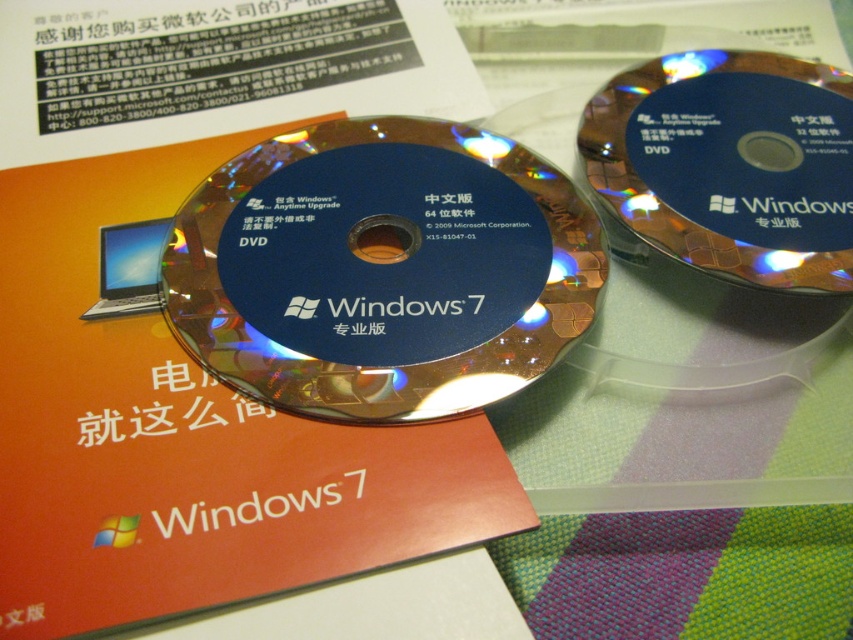
From the picture: Who is positioned more to the left, glossy blue dvd at center or blue glossy dvd at upper right?

glossy blue dvd at center is more to the left.

This screenshot has width=853, height=640. In order to click on glossy blue dvd at center in this screenshot , I will do `click(381, 269)`.